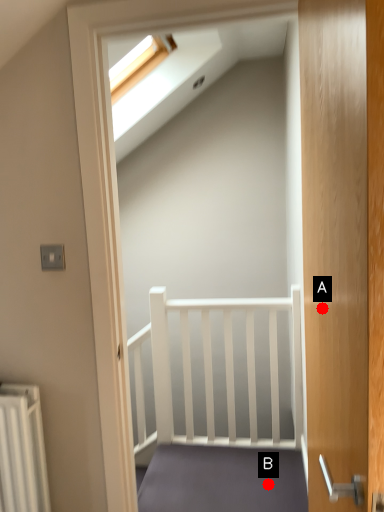
Question: Two points are circled on the image, labeled by A and B beside each circle. Among these points, which one is nearest to the camera?

Choices:
 (A) A is closer
 (B) B is closer

Answer: (A)